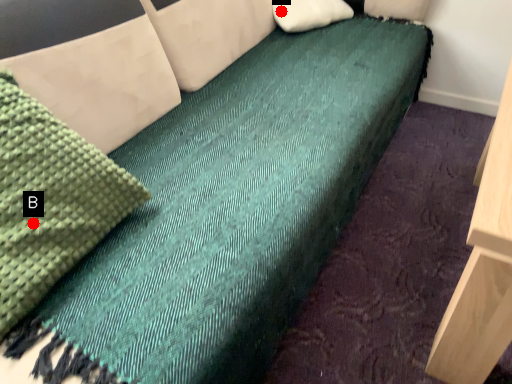
Question: Two points are circled on the image, labeled by A and B beside each circle. Which point appears closest to the camera in this image?

Choices:
 (A) A is closer
 (B) B is closer

Answer: (B)